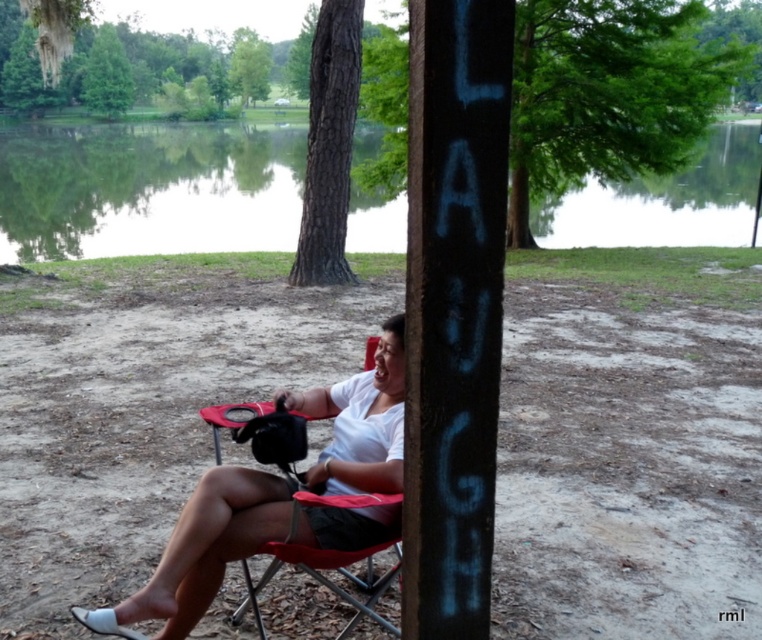
Can you confirm if dark brown bark tree at upper center is positioned below green leafy tree at upper center?

Yes, dark brown bark tree at upper center is below green leafy tree at upper center.

Image resolution: width=762 pixels, height=640 pixels. What do you see at coordinates (328, 145) in the screenshot?
I see `dark brown bark tree at upper center` at bounding box center [328, 145].

Locate an element on the screen. dark brown bark tree at upper center is located at coordinates (328, 145).

Where is `dark brown bark tree at upper center`? The image size is (762, 640). dark brown bark tree at upper center is located at coordinates (328, 145).

Is point (239, 138) positioned after point (101, 83)?

Yes.

Which is more to the right, green reflective water at upper center or green leafy tree at upper center?

Positioned to the right is green reflective water at upper center.

Where is `green reflective water at upper center`? The width and height of the screenshot is (762, 640). green reflective water at upper center is located at coordinates (146, 189).

Between green reflective water at upper center and dark brown bark tree at upper center, which one is positioned higher?

Positioned higher is green reflective water at upper center.

The height and width of the screenshot is (640, 762). Describe the element at coordinates (146, 189) in the screenshot. I see `green reflective water at upper center` at that location.

What do you see at coordinates (146, 189) in the screenshot? I see `green reflective water at upper center` at bounding box center [146, 189].

The image size is (762, 640). Find the location of `green reflective water at upper center`. green reflective water at upper center is located at coordinates (146, 189).